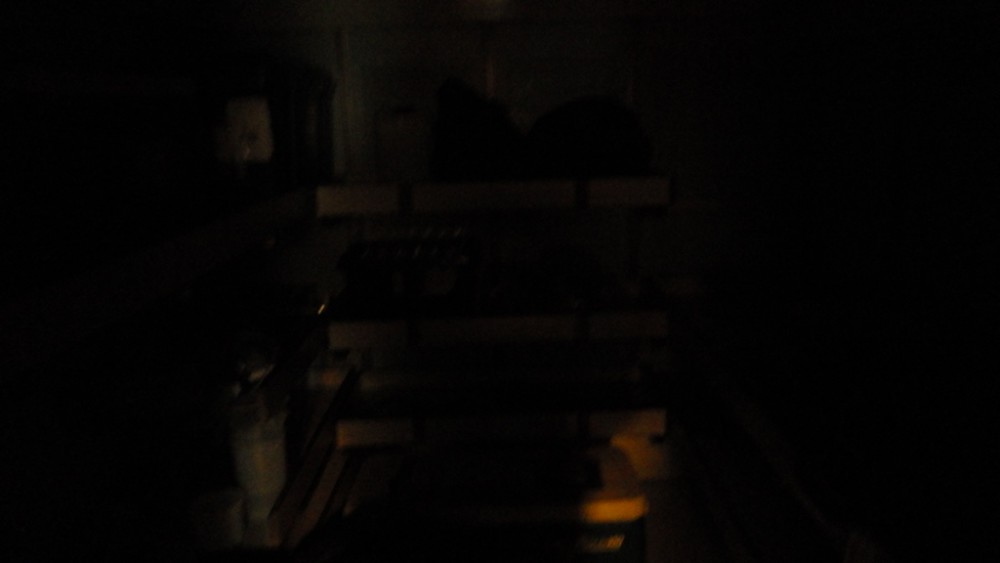
Where is `shelves`? The image size is (1000, 563). shelves is located at coordinates (613, 186).